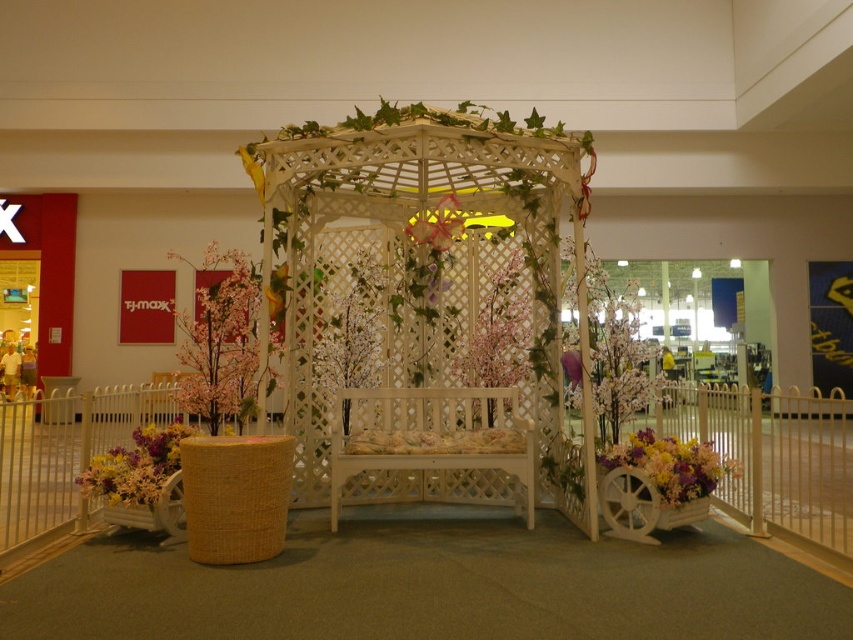
What do you see at coordinates (428, 307) in the screenshot?
I see `white lattice gazebo at center` at bounding box center [428, 307].

Is point (480, 465) less distant than point (683, 467)?

No, (480, 465) is further to viewer.

The image size is (853, 640). Find the location of `white lattice gazebo at center`. white lattice gazebo at center is located at coordinates (428, 307).

Is white lattice gazebo at center in front of pink artificial tree at left?

Yes, white lattice gazebo at center is in front of pink artificial tree at left.

Does white lattice gazebo at center have a lesser width compared to pink artificial tree at left?

No.

Who is more forward, (444, 484) or (216, 420)?

Positioned in front is point (216, 420).

Find the location of a particular element. The height and width of the screenshot is (640, 853). white lattice gazebo at center is located at coordinates (428, 307).

Is floral bouquet at lower right bigger than vibrant floral bouquet at lower left?

Yes, floral bouquet at lower right is bigger than vibrant floral bouquet at lower left.

Does point (637, 458) come farther from viewer compared to point (160, 458)?

No, it is not.

Identify the location of floral bouquet at lower right. Image resolution: width=853 pixels, height=640 pixels. coord(671,465).